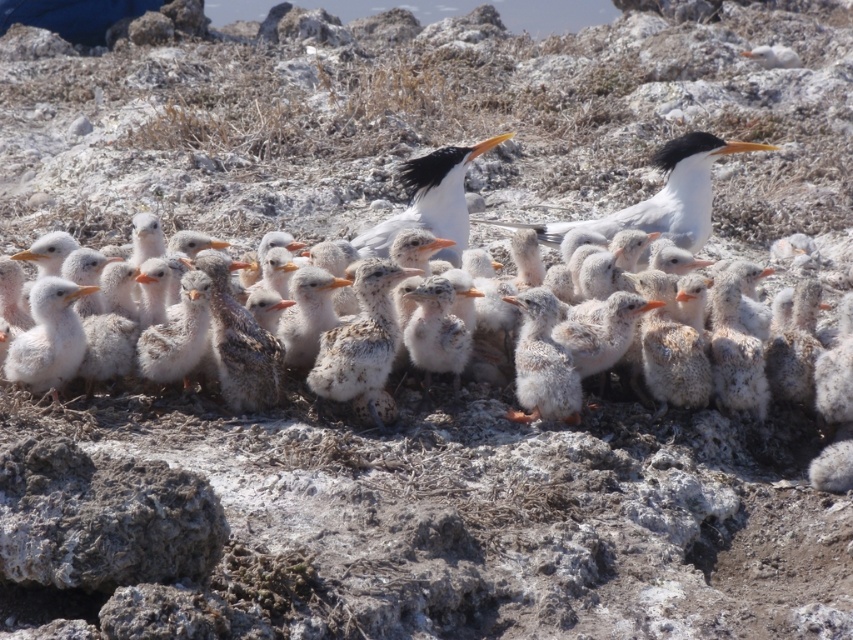
Is point (660, 168) positioned after point (76, 330)?

Yes, it is.

You are a GUI agent. You are given a task and a screenshot of the screen. Output one action in this format:
    pyautogui.click(x=<x>, y=<y>)
    Task: Click on the white glossy bird at upper center
    
    Given the screenshot: What is the action you would take?
    pyautogui.click(x=664, y=195)

From the picture: Which of these two, white fluffy bird at center or white glossy bird at upper center, stands shorter?

With less height is white glossy bird at upper center.

Does white fluffy bird at center appear under white glossy bird at upper center?

Yes.

Is point (793, 317) closer to viewer compared to point (711, 145)?

Yes.

I want to click on white fluffy bird at center, so click(804, 330).

Is white feathered bird at center to the right of white fluffy chick at left from the viewer's perspective?

Correct, you'll find white feathered bird at center to the right of white fluffy chick at left.

Is point (403, 170) positioned after point (36, 321)?

Yes, it is behind point (36, 321).

Who is more distant from viewer, (430, 157) or (67, 310)?

The point (430, 157) is behind.

Locate an element on the screen. This screenshot has width=853, height=640. white feathered bird at center is located at coordinates (430, 200).